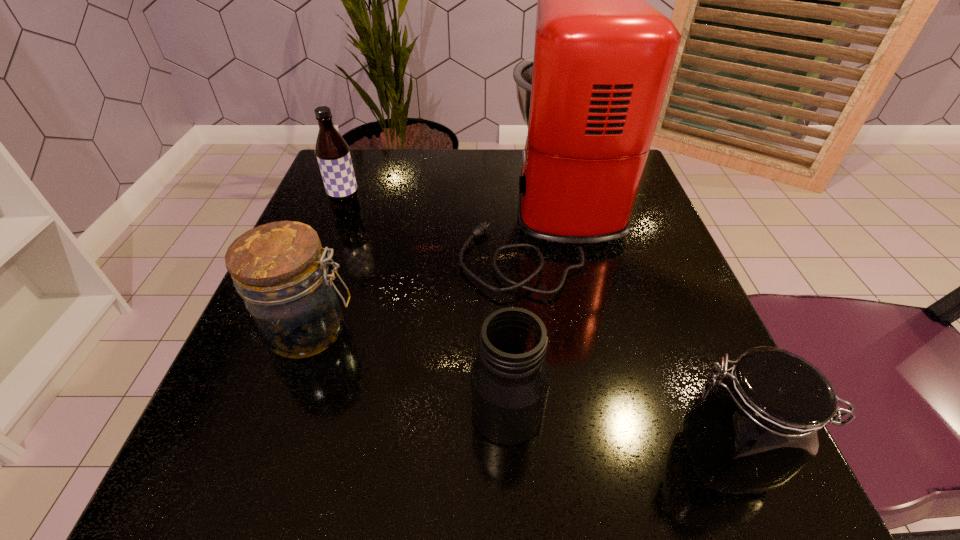
Find the location of a particular element. Image resolution: width=960 pixels, height=540 pixels. jar present at the right edge is located at coordinates (752, 430).

Locate an element on the screen. object that is positioned at the far left corner is located at coordinates (332, 152).

The height and width of the screenshot is (540, 960). I want to click on object that is at the far right corner, so click(x=591, y=96).

Locate an element on the screen. This screenshot has height=540, width=960. object located at the near right corner is located at coordinates (752, 430).

Where is `free space at the far edge of the desktop`? free space at the far edge of the desktop is located at coordinates (441, 185).

This screenshot has height=540, width=960. Identify the location of free space at the near edge of the desktop. (612, 503).

Locate an element on the screen. This screenshot has width=960, height=540. vacant space at the left edge of the desktop is located at coordinates pos(352,273).

You are a GUI agent. You are given a task and a screenshot of the screen. Output one action in this format:
    pyautogui.click(x=<x>, y=<y>)
    Task: Click on the free spot at the right edge of the desktop
    The width and height of the screenshot is (960, 540).
    Given the screenshot: What is the action you would take?
    pyautogui.click(x=634, y=279)

Locate an element on the screen. vacant space at the near left corner is located at coordinates (239, 517).

Image resolution: width=960 pixels, height=540 pixels. I want to click on empty space between the rightmost jar and the tallest object, so click(x=633, y=334).